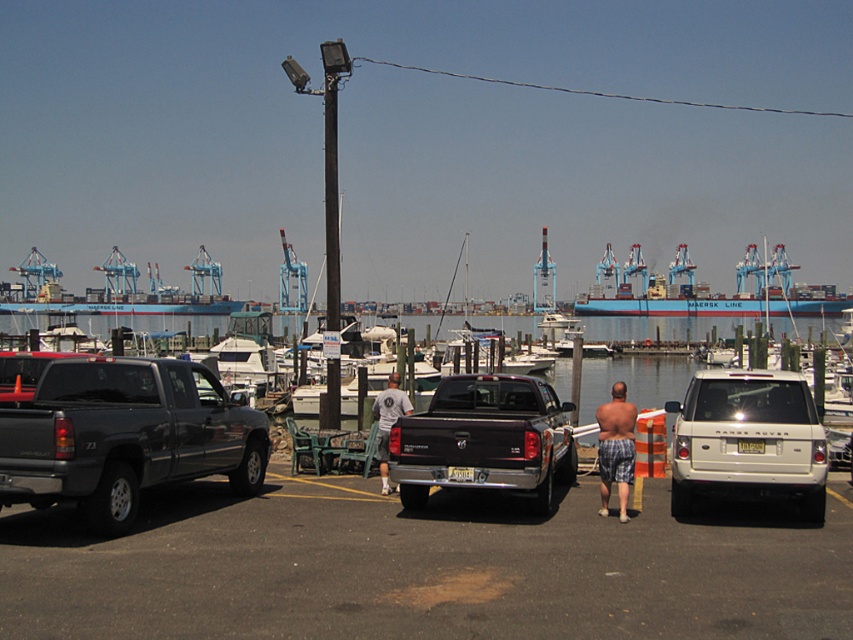
Which is behind, point (134, 416) or point (474, 435)?

The point (474, 435) is behind.

Does matte black truck at left have a greater height compared to black matte truck at center?

Correct, matte black truck at left is much taller as black matte truck at center.

Which is in front, point (125, 496) or point (450, 403)?

Point (125, 496) is in front.

This screenshot has width=853, height=640. Find the location of `matte black truck at left`. matte black truck at left is located at coordinates (125, 436).

Can you confirm if blue matte container ship at center is bigger than blue plaid shorts at center?

Yes.

Who is lower down, blue matte container ship at center or blue plaid shorts at center?

blue plaid shorts at center

Does point (801, 314) lie behind point (634, 412)?

Yes, point (801, 314) is behind point (634, 412).

The height and width of the screenshot is (640, 853). I want to click on blue matte container ship at center, so click(706, 291).

Who is shorter, matte black truck at left or blue matte container ship at center?

matte black truck at left is shorter.

Does point (143, 472) come in front of point (595, 308)?

Yes, point (143, 472) is in front of point (595, 308).

Between point (68, 496) and point (786, 301), which one is positioned in front?

Point (68, 496)

This screenshot has width=853, height=640. Identify the location of matte black truck at left. (125, 436).